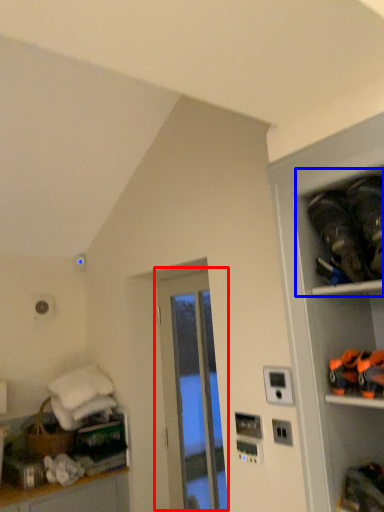
Question: Among these objects, which one is farthest to the camera, door (highlighted by a red box) or shelf (highlighted by a blue box)?

Choices:
 (A) door
 (B) shelf

Answer: (A)